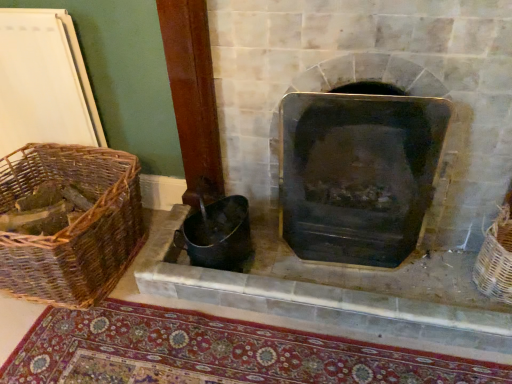
In order to click on free region on the left part of woven wicker basket at right, the 2th basket positioned from the left in this screenshot , I will do `click(434, 283)`.